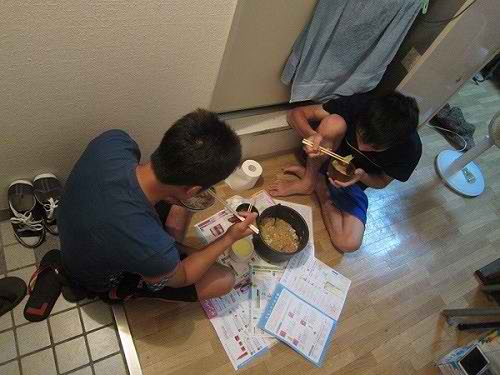
Locate an element on the screen. papers is located at coordinates click(309, 303), click(267, 270), click(236, 297).